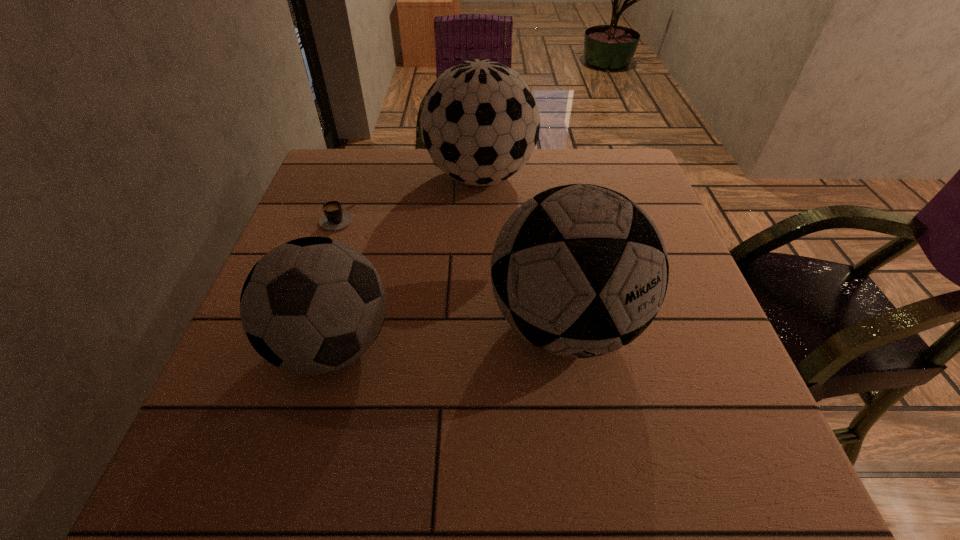
Identify the location of the farthest soccer ball. (480, 122).

Find the location of a particular element. This screenshot has height=540, width=960. the leftmost soccer ball is located at coordinates (313, 305).

I want to click on the third tallest object, so click(x=313, y=305).

Locate an element on the screen. This screenshot has height=540, width=960. cappuccino is located at coordinates (334, 218).

Locate an element on the screen. The image size is (960, 540). vacant space located 0.160m on the right of the farthest soccer ball is located at coordinates (593, 177).

Find the location of a particular element. This screenshot has width=960, height=540. vacant space located on the main logo of the third tallest object is located at coordinates (298, 469).

I want to click on free space located 0.130m with the handle on the side of the shortest object, so 318,272.

Locate an element on the screen. The height and width of the screenshot is (540, 960). object that is at the far edge is located at coordinates (480, 122).

The image size is (960, 540). Identify the location of soccer ball that is at the left edge. point(313,305).

Locate an element on the screen. cappuccino that is at the left edge is located at coordinates (334, 218).